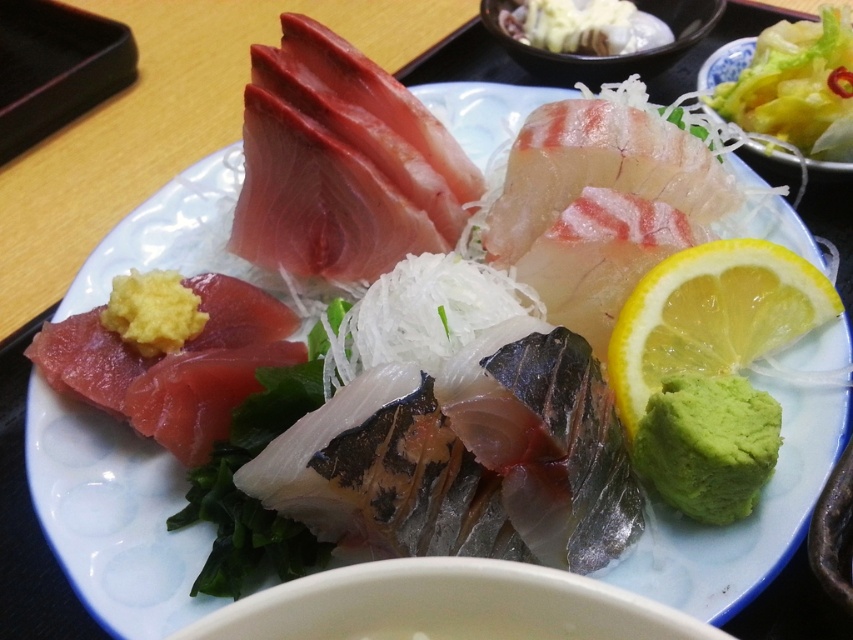
Question: Considering the real-world distances, which object is farthest from the green paste at lower right?

Choices:
 (A) yellow juicy lemon at right
 (B) translucent white shredded vegetables at upper right

Answer: (B)

Question: In this image, where is green paste at lower right located relative to translucent white shredded vegetables at upper right?

Choices:
 (A) right
 (B) left

Answer: (B)

Question: Which point appears closest to the camera in this image?

Choices:
 (A) (833, 317)
 (B) (831, 156)

Answer: (A)

Question: Considering the relative positions of yellow juicy lemon at right and translucent white shredded vegetables at upper right in the image provided, where is yellow juicy lemon at right located with respect to translucent white shredded vegetables at upper right?

Choices:
 (A) right
 (B) left

Answer: (B)

Question: Can you confirm if yellow juicy lemon at right is positioned below translucent white shredded vegetables at upper right?

Choices:
 (A) no
 (B) yes

Answer: (B)

Question: Among these points, which one is nearest to the camera?

Choices:
 (A) (630, 432)
 (B) (723, 426)

Answer: (B)